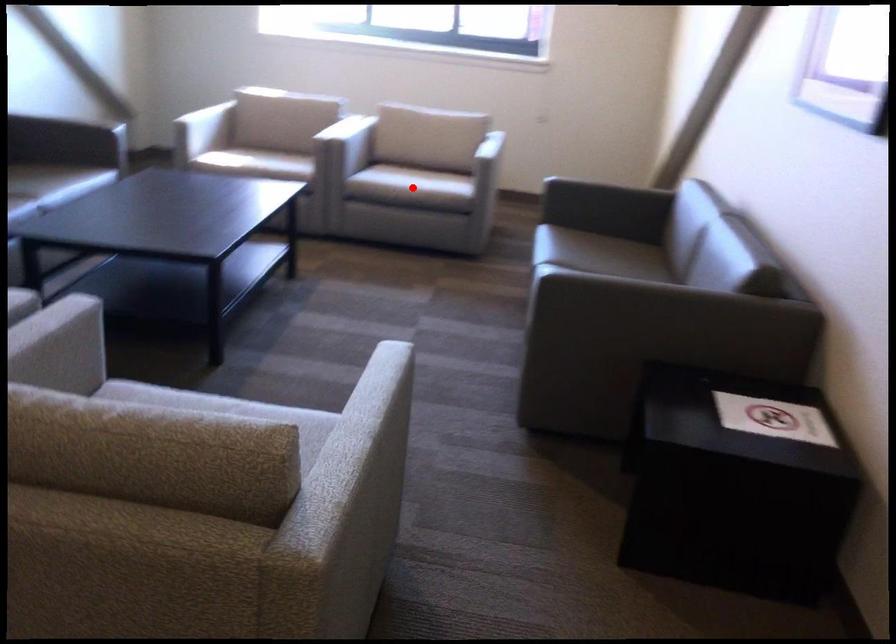
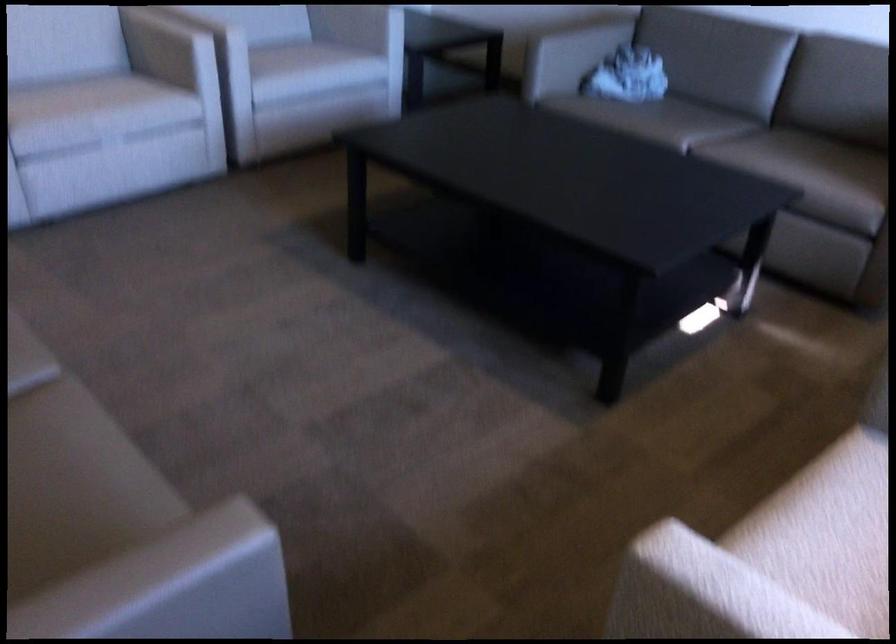
Question: I am providing you with two images of the same scene from different viewpoints. A red point is marked on the first image. At the location where the point appears in image 1, is it still visible in image 2?

Choices:
 (A) Yes
 (B) No

Answer: (B)